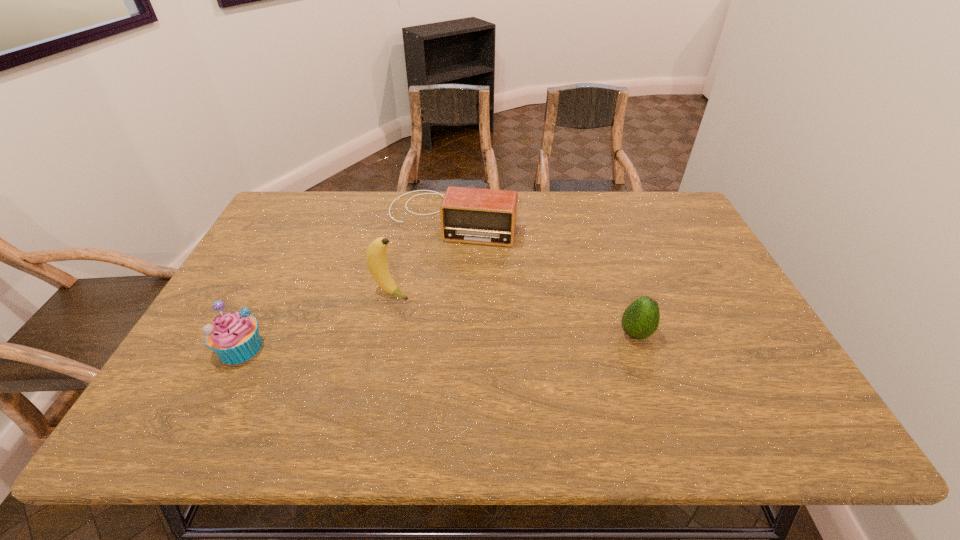
Identify the location of free area in between the leftmost object and the third nearest object. (316, 320).

Identify the location of free space between the banana and the leftmost object. (316, 320).

At what (x,y) coordinates should I click in order to perform the action: click on blank region between the farthest object and the rightmost object. Please return your answer as a coordinate pair (x, y). Looking at the image, I should click on (543, 276).

This screenshot has height=540, width=960. What are the coordinates of `blank region between the muffin and the rightmost object` in the screenshot? It's located at (438, 341).

This screenshot has height=540, width=960. Identify the location of object that ranks as the third closest to the farthest object. pyautogui.click(x=234, y=337).

Locate an element on the screen. The image size is (960, 540). object that is the third closest to the muffin is located at coordinates (640, 320).

Where is `vacant region that satisfies the following two spatial constraints: 1. on the back side of the leftmost object; 2. on the left side of the second farthest object`? This screenshot has width=960, height=540. vacant region that satisfies the following two spatial constraints: 1. on the back side of the leftmost object; 2. on the left side of the second farthest object is located at coordinates (269, 292).

In order to click on blank area in the image that satisfies the following two spatial constraints: 1. on the front side of the second farthest object; 2. on the right side of the avocado in this screenshot , I will do `click(382, 334)`.

You are a GUI agent. You are given a task and a screenshot of the screen. Output one action in this format:
    pyautogui.click(x=<x>, y=<y>)
    Task: Click on the vacant area in the image that satisfies the following two spatial constraints: 1. on the back side of the muffin; 2. on the left side of the avocado
    The image size is (960, 540).
    Given the screenshot: What is the action you would take?
    pyautogui.click(x=248, y=334)

Locate an element on the screen. Image resolution: width=960 pixels, height=540 pixels. vacant space that satisfies the following two spatial constraints: 1. on the front side of the rightmost object; 2. on the left side of the second farthest object is located at coordinates (382, 334).